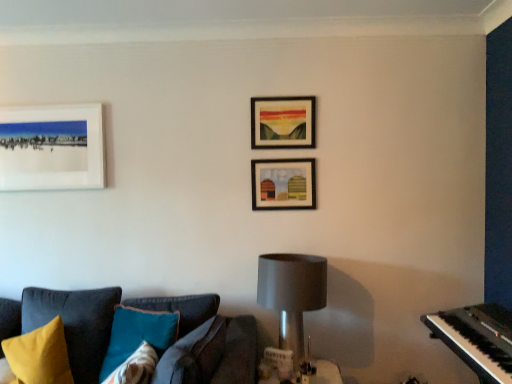
Identify the location of yellow fabric pillow at lower left, marked as the 1th pillow in a left-to-right arrangement. This screenshot has width=512, height=384. (38, 356).

From the picture: In order to face satin silver lampshade at center, should I rotate leftwards or rightwards?

A 4.856 degree turn to the right will do.

Where is `teal velvet pillow at lower left, the 2th pillow from the left`? This screenshot has width=512, height=384. teal velvet pillow at lower left, the 2th pillow from the left is located at coordinates (137, 344).

This screenshot has width=512, height=384. What are the coordinates of `black plastic piano at right` in the screenshot? It's located at (477, 338).

Can you confirm if white matte picture frame at upper left, the 3th picture frame viewed from the right, is smaller than yellow fabric pillow at lower left, the second pillow when ordered from right to left?

Indeed, white matte picture frame at upper left, the 3th picture frame viewed from the right, has a smaller size compared to yellow fabric pillow at lower left, the second pillow when ordered from right to left.

Is yellow fabric pillow at lower left, the second pillow when ordered from right to left, located within white matte picture frame at upper left, the 3th picture frame viewed from the right?

No, yellow fabric pillow at lower left, the second pillow when ordered from right to left, is not inside white matte picture frame at upper left, the 3th picture frame viewed from the right.

Is point (70, 131) farther from viewer compared to point (8, 348)?

Yes, point (70, 131) is behind point (8, 348).

From a real-world perspective, is white matte picture frame at upper left, the 1th picture frame in the left-to-right sequence, below yellow fabric pillow at lower left, marked as the 1th pillow in a left-to-right arrangement?

No, from a real-world perspective, white matte picture frame at upper left, the 1th picture frame in the left-to-right sequence, is not under yellow fabric pillow at lower left, marked as the 1th pillow in a left-to-right arrangement.

Can you tell me how much wooden frame at upper center, positioned as the second picture frame in left-to-right order, and teal velvet pillow at lower left, arranged as the first pillow when viewed from the right, differ in facing direction?

The angular difference between wooden frame at upper center, positioned as the second picture frame in left-to-right order, and teal velvet pillow at lower left, arranged as the first pillow when viewed from the right, is 28.9 degrees.

Is wooden frame at upper center, arranged as the second picture frame when viewed from the right, in front of or behind teal velvet pillow at lower left, the 2th pillow from the left, in the image?

wooden frame at upper center, arranged as the second picture frame when viewed from the right, is positioned farther from the viewer than teal velvet pillow at lower left, the 2th pillow from the left.

From a real-world perspective, who is located higher, wooden frame at upper center, arranged as the second picture frame when viewed from the right, or teal velvet pillow at lower left, arranged as the first pillow when viewed from the right?

In real-world perspective, wooden frame at upper center, arranged as the second picture frame when viewed from the right, is above.

Is wooden frame at upper center, arranged as the second picture frame when viewed from the right, to the right of teal velvet pillow at lower left, arranged as the first pillow when viewed from the right, from the viewer's perspective?

Yes.

Is wooden frame at center, arranged as the first picture frame when viewed from the right, in front of or behind yellow fabric pillow at lower left, the second pillow when ordered from right to left, in the image?

In the image, wooden frame at center, arranged as the first picture frame when viewed from the right, appears behind yellow fabric pillow at lower left, the second pillow when ordered from right to left.

Can you see wooden frame at center, arranged as the first picture frame when viewed from the right, touching yellow fabric pillow at lower left, the second pillow when ordered from right to left?

They are not placed beside each other.

Considering the relative sizes of wooden frame at center, arranged as the first picture frame when viewed from the right, and yellow fabric pillow at lower left, marked as the 1th pillow in a left-to-right arrangement, in the image provided, is wooden frame at center, arranged as the first picture frame when viewed from the right, taller than yellow fabric pillow at lower left, marked as the 1th pillow in a left-to-right arrangement,?

Incorrect, the height of wooden frame at center, arranged as the first picture frame when viewed from the right, is not larger of that of yellow fabric pillow at lower left, marked as the 1th pillow in a left-to-right arrangement.

From a real-world perspective, which object stands above the other?

wooden frame at center, arranged as the first picture frame when viewed from the right, is physically above.

From the image's perspective, is white matte picture frame at upper left, the 3th picture frame viewed from the right, beneath teal velvet pillow at lower left, the 2th pillow from the left?

No, from the image's perspective, white matte picture frame at upper left, the 3th picture frame viewed from the right, is not beneath teal velvet pillow at lower left, the 2th pillow from the left.

In terms of height, does white matte picture frame at upper left, the 3th picture frame viewed from the right, look taller or shorter compared to teal velvet pillow at lower left, arranged as the first pillow when viewed from the right?

In the image, white matte picture frame at upper left, the 3th picture frame viewed from the right, appears to be taller than teal velvet pillow at lower left, arranged as the first pillow when viewed from the right.

Considering the relative sizes of white matte picture frame at upper left, the 1th picture frame in the left-to-right sequence, and teal velvet pillow at lower left, arranged as the first pillow when viewed from the right, in the image provided, is white matte picture frame at upper left, the 1th picture frame in the left-to-right sequence, wider than teal velvet pillow at lower left, arranged as the first pillow when viewed from the right,?

No.

From a real-world perspective, is white matte picture frame at upper left, the 3th picture frame viewed from the right, positioned above or below teal velvet pillow at lower left, the 2th pillow from the left?

white matte picture frame at upper left, the 3th picture frame viewed from the right, is situated higher than teal velvet pillow at lower left, the 2th pillow from the left, in the real world.

How far apart are wooden frame at center, placed as the 3th picture frame when sorted from left to right, and teal velvet pillow at lower left, the 2th pillow from the left?

The distance of wooden frame at center, placed as the 3th picture frame when sorted from left to right, from teal velvet pillow at lower left, the 2th pillow from the left, is 37.32 inches.

Is wooden frame at center, placed as the 3th picture frame when sorted from left to right, touching teal velvet pillow at lower left, arranged as the first pillow when viewed from the right?

They are not placed beside each other.

Is wooden frame at center, placed as the 3th picture frame when sorted from left to right, in front of or behind teal velvet pillow at lower left, arranged as the first pillow when viewed from the right, in the image?

Clearly, wooden frame at center, placed as the 3th picture frame when sorted from left to right, is behind teal velvet pillow at lower left, arranged as the first pillow when viewed from the right.

Between wooden frame at center, arranged as the first picture frame when viewed from the right, and teal velvet pillow at lower left, the 2th pillow from the left, which one has smaller size?

With smaller size is wooden frame at center, arranged as the first picture frame when viewed from the right.

From a real-world perspective, is wooden frame at upper center, positioned as the second picture frame in left-to-right order, over white matte picture frame at upper left, the 1th picture frame in the left-to-right sequence?

Yes, from a real-world perspective, wooden frame at upper center, positioned as the second picture frame in left-to-right order, is on top of white matte picture frame at upper left, the 1th picture frame in the left-to-right sequence.

Is point (305, 117) closer to camera compared to point (48, 142)?

Yes.

Is wooden frame at upper center, arranged as the second picture frame when viewed from the right, not inside white matte picture frame at upper left, the 1th picture frame in the left-to-right sequence?

wooden frame at upper center, arranged as the second picture frame when viewed from the right, lies outside white matte picture frame at upper left, the 1th picture frame in the left-to-right sequence,'s area.

Based on their sizes in the image, would you say satin silver lampshade at center is bigger or smaller than teal velvet pillow at lower left, the 2th pillow from the left?

Considering their sizes, satin silver lampshade at center takes up more space than teal velvet pillow at lower left, the 2th pillow from the left.

From a real-world perspective, is satin silver lampshade at center below teal velvet pillow at lower left, arranged as the first pillow when viewed from the right?

Incorrect, from a real-world perspective, satin silver lampshade at center is higher than teal velvet pillow at lower left, arranged as the first pillow when viewed from the right.

Image resolution: width=512 pixels, height=384 pixels. Identify the location of table lamp on the right of teal velvet pillow at lower left, arranged as the first pillow when viewed from the right. click(292, 294).

Considering their positions, is satin silver lampshade at center located in front of or behind teal velvet pillow at lower left, arranged as the first pillow when viewed from the right?

Clearly, satin silver lampshade at center is behind teal velvet pillow at lower left, arranged as the first pillow when viewed from the right.

Locate an element on the screen. Image resolution: width=512 pixels, height=384 pixels. picture frame that is on the left side of yellow fabric pillow at lower left, marked as the 1th pillow in a left-to-right arrangement is located at coordinates (52, 147).

I want to click on pillow that is the 2nd object located in front of the wooden frame at upper center, arranged as the second picture frame when viewed from the right, so click(x=137, y=344).

Consider the image. Considering their positions, is black plastic piano at right positioned further to white matte picture frame at upper left, the 1th picture frame in the left-to-right sequence, than wooden frame at upper center, positioned as the second picture frame in left-to-right order?

Based on the image, black plastic piano at right appears to be further to white matte picture frame at upper left, the 1th picture frame in the left-to-right sequence.

Based on their spatial positions, is teal velvet pillow at lower left, arranged as the first pillow when viewed from the right, or wooden frame at center, arranged as the first picture frame when viewed from the right, further from black plastic piano at right?

teal velvet pillow at lower left, arranged as the first pillow when viewed from the right.

Considering their positions, is black plastic piano at right positioned closer to white matte picture frame at upper left, the 3th picture frame viewed from the right, than satin silver lampshade at center?

Answer: Based on the image, satin silver lampshade at center appears to be nearer to white matte picture frame at upper left, the 3th picture frame viewed from the right.

Based on their spatial positions, is wooden frame at center, placed as the 3th picture frame when sorted from left to right, or yellow fabric pillow at lower left, the second pillow when ordered from right to left, further from white matte picture frame at upper left, the 1th picture frame in the left-to-right sequence?

The object further to white matte picture frame at upper left, the 1th picture frame in the left-to-right sequence, is wooden frame at center, placed as the 3th picture frame when sorted from left to right.

Considering their positions, is yellow fabric pillow at lower left, the second pillow when ordered from right to left, positioned further to wooden frame at upper center, positioned as the second picture frame in left-to-right order, than black plastic piano at right?

yellow fabric pillow at lower left, the second pillow when ordered from right to left, lies further to wooden frame at upper center, positioned as the second picture frame in left-to-right order, than the other object.

Estimate the real-world distances between objects in this image. Which object is further from white matte picture frame at upper left, the 3th picture frame viewed from the right, yellow fabric pillow at lower left, the second pillow when ordered from right to left, or black plastic piano at right?

black plastic piano at right is further to white matte picture frame at upper left, the 3th picture frame viewed from the right.

Looking at the image, which one is located closer to yellow fabric pillow at lower left, marked as the 1th pillow in a left-to-right arrangement, white matte picture frame at upper left, the 1th picture frame in the left-to-right sequence, or teal velvet pillow at lower left, the 2th pillow from the left?

teal velvet pillow at lower left, the 2th pillow from the left, is closer to yellow fabric pillow at lower left, marked as the 1th pillow in a left-to-right arrangement.

Looking at the image, which one is located further to wooden frame at upper center, arranged as the second picture frame when viewed from the right, black plastic piano at right or yellow fabric pillow at lower left, the second pillow when ordered from right to left?

yellow fabric pillow at lower left, the second pillow when ordered from right to left, is positioned further to the anchor wooden frame at upper center, arranged as the second picture frame when viewed from the right.

Image resolution: width=512 pixels, height=384 pixels. I want to click on table lamp between black plastic piano at right and wooden frame at upper center, arranged as the second picture frame when viewed from the right, in the front-back direction, so 292,294.

I want to click on pillow between wooden frame at upper center, arranged as the second picture frame when viewed from the right, and yellow fabric pillow at lower left, the second pillow when ordered from right to left, in the vertical direction, so click(137, 344).

Where is `pillow between yellow fabric pillow at lower left, the second pillow when ordered from right to left, and satin silver lampshade at center from left to right`? pillow between yellow fabric pillow at lower left, the second pillow when ordered from right to left, and satin silver lampshade at center from left to right is located at coordinates (137, 344).

Find the location of a particular element. picture frame located between yellow fabric pillow at lower left, marked as the 1th pillow in a left-to-right arrangement, and wooden frame at center, arranged as the first picture frame when viewed from the right, in the left-right direction is located at coordinates (283, 122).